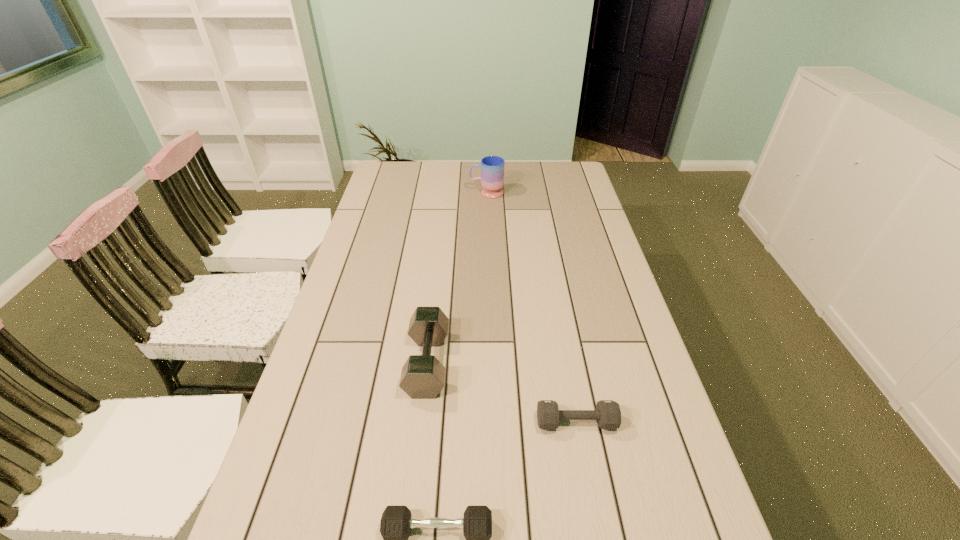
Where is `unoccupied position between the third farthest object and the farthest dumbbell`? This screenshot has width=960, height=540. unoccupied position between the third farthest object and the farthest dumbbell is located at coordinates (502, 393).

At what (x,y) coordinates should I click in order to perform the action: click on unoccupied position between the second farthest dumbbell and the tallest object. Please return your answer as a coordinate pair (x, y). The height and width of the screenshot is (540, 960). Looking at the image, I should click on (531, 307).

The width and height of the screenshot is (960, 540). I want to click on vacant area between the farthest object and the tallest dumbbell, so click(x=457, y=278).

Select which object appears as the closest to the mug. Please provide its 2D coordinates. Your answer should be formatted as a tuple, i.e. [(x, y)], where the tuple contains the x and y coordinates of a point satisfying the conditions above.

[(422, 377)]

Find the location of a particular element. This screenshot has height=540, width=960. the third closest object to the farthest dumbbell is located at coordinates (492, 167).

Identify the location of the closest dumbbell to the rightmost dumbbell. The height and width of the screenshot is (540, 960). (396, 522).

Locate an element on the screen. The width and height of the screenshot is (960, 540). dumbbell that stands as the second closest to the nearest object is located at coordinates (422, 377).

This screenshot has height=540, width=960. In order to click on free spot that satisfies the following two spatial constraints: 1. on the side of the mug with the handle; 2. on the back side of the second nearest object in this screenshot , I will do `click(492, 422)`.

Find the location of a particular element. The image size is (960, 540). vacant space that satisfies the following two spatial constraints: 1. on the front side of the rightmost object; 2. on the left side of the tallest dumbbell is located at coordinates (420, 422).

Identify the location of vacant space that satisfies the following two spatial constraints: 1. on the side of the farthest object with the handle; 2. on the left side of the rightmost object. (492, 422).